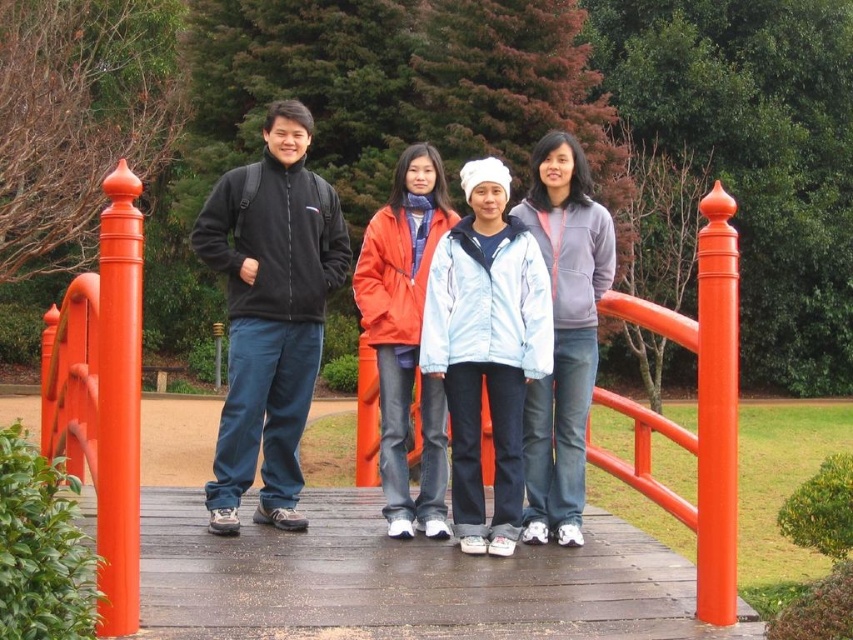
You are a photographer trying to capture a group photo of the matte black jacket at center and the light blue fleece jacket at center. Since you want to ensure both are clearly visible, which jacket should you focus on first to account for their sizes?

The matte black jacket at center is bigger than the light blue fleece jacket at center, so you should focus on the matte black jacket at center first to ensure it is in clear focus before adjusting for the smaller one.

You are a photographer trying to capture a group photo of the light blue fleece jacket at center and the gray fleece jacket at center. If you want to ensure both jackets are fully visible in the frame, which jacket should you focus on to avoid cropping either of them?

You should focus on the light blue fleece jacket at center since its width is larger than the gray fleece jacket at center, ensuring both can fit without cropping.

You are standing on the wooden bridge with orange railings and want to walk towards the point at coordinates point (x=577, y=237) and point (x=422, y=182). Which point should you walk towards first to reach both points in the most efficient path?

You should walk towards point (x=577, y=237) first because it is in front of point (x=422, y=182), so reaching it first allows you to efficiently move backward to the second point without retracing steps.